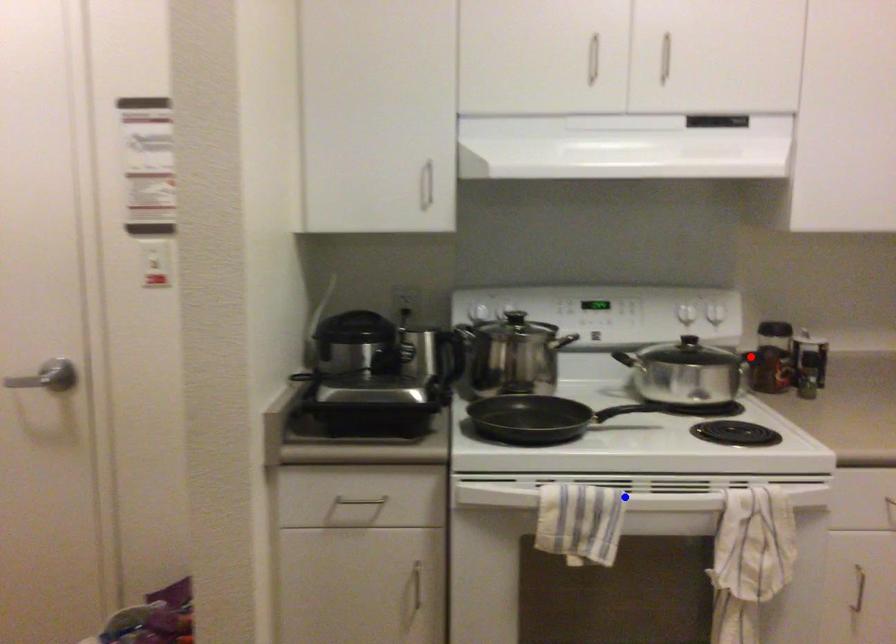
Question: Two points are marked on the image. Which point is closer to the camera?

Choices:
 (A) Blue point is closer.
 (B) Red point is closer.

Answer: (A)